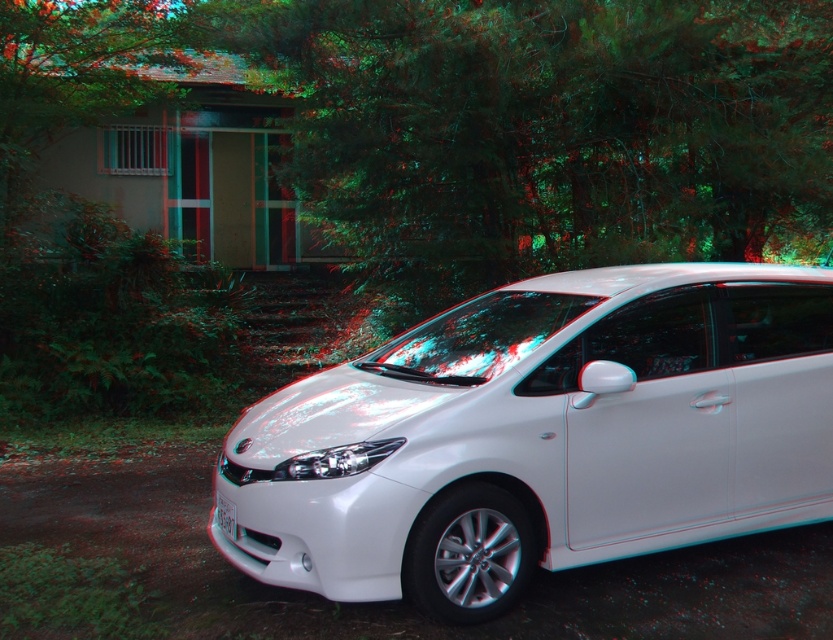
You are a driver who just parked your car in a wooded area. You want to check the license plate number but notice a green leafy tree at center blocking your view. Which direction should you move your head to see the white plastic license plate at center?

The green leafy tree at center is to the right of the white plastic license plate at center. To see the white plastic license plate at center, you should move your head to the left.

You are standing in the wooded area and see the point at coordinates (541, 436). Which object in the image does this point belong to?

The point at coordinates (541, 436) belongs to the white glossy car at center.

Consider the image. You are navigating a delivery drone to a white glossy car at center in the image. The drone must land precisely on the car. Given the car is at coordinates 0.683 on the x and 0.651 on the y axis, can you confirm the exact position to ensure a safe landing?

The white glossy car at center is located at point 0.683 on the x axis and 0.651 on the y axis, so the drone can safely land there using those coordinates.